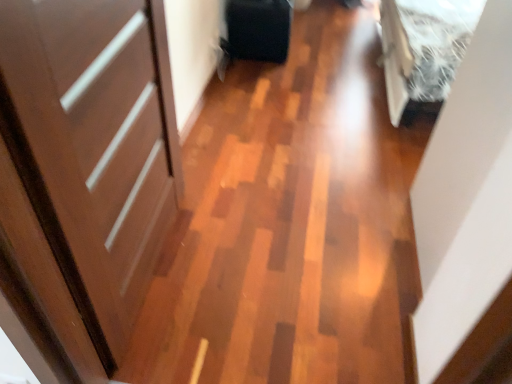
This screenshot has width=512, height=384. What are the coordinates of `vacant area that lies between matte black suitcase at center and matte brown door at left` in the screenshot? It's located at (229, 129).